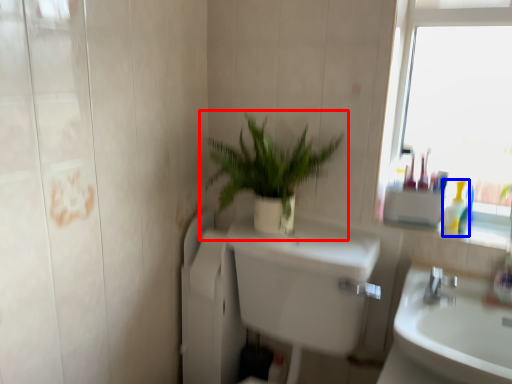
Question: Which object is further to the camera taking this photo, houseplant (highlighted by a red box) or toiletry (highlighted by a blue box)?

Choices:
 (A) houseplant
 (B) toiletry

Answer: (B)